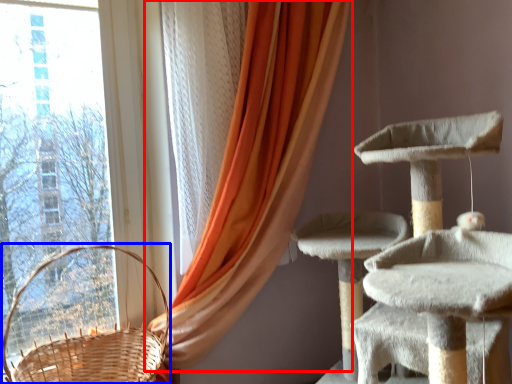
Question: Which of the following is the closest to the observer, curtain (highlighted by a red box) or basket (highlighted by a blue box)?

Choices:
 (A) curtain
 (B) basket

Answer: (B)